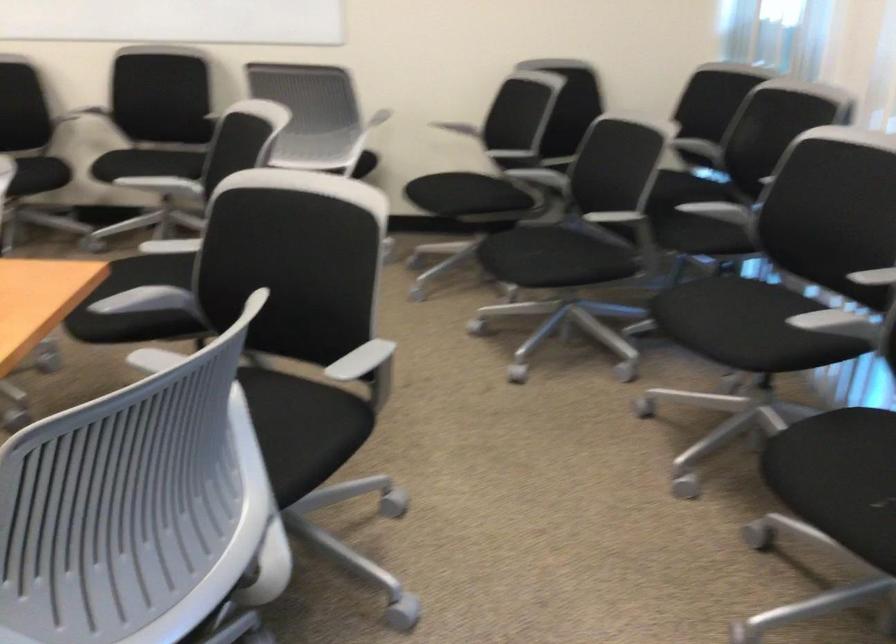
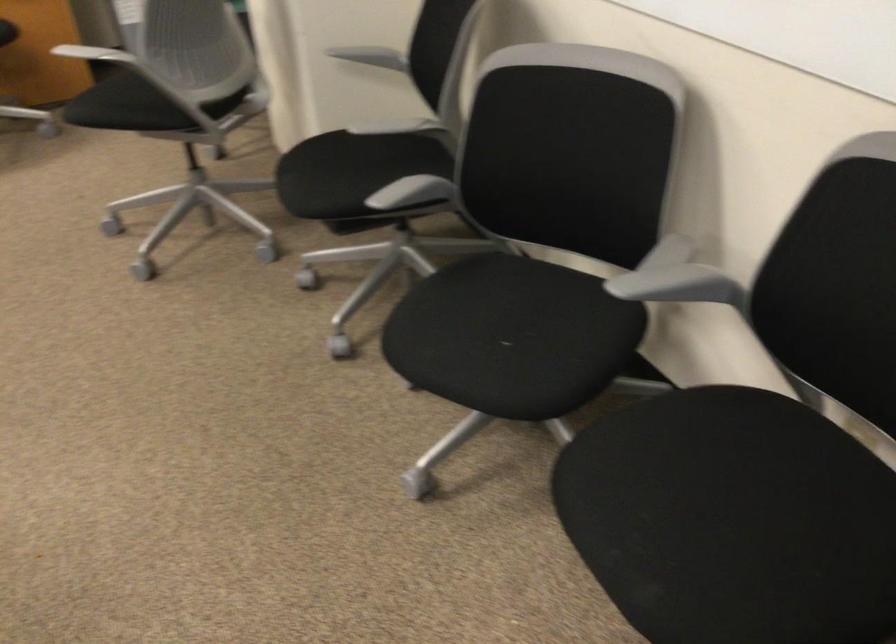
Find the pixel in the second image that matches (x=101, y=100) in the first image.

(677, 279)